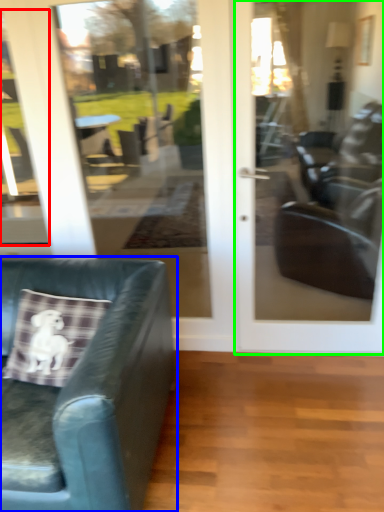
Question: Which is nearer to the window (highlighted by a red box)? chair (highlighted by a blue box) or door (highlighted by a green box).

Choices:
 (A) chair
 (B) door

Answer: (A)